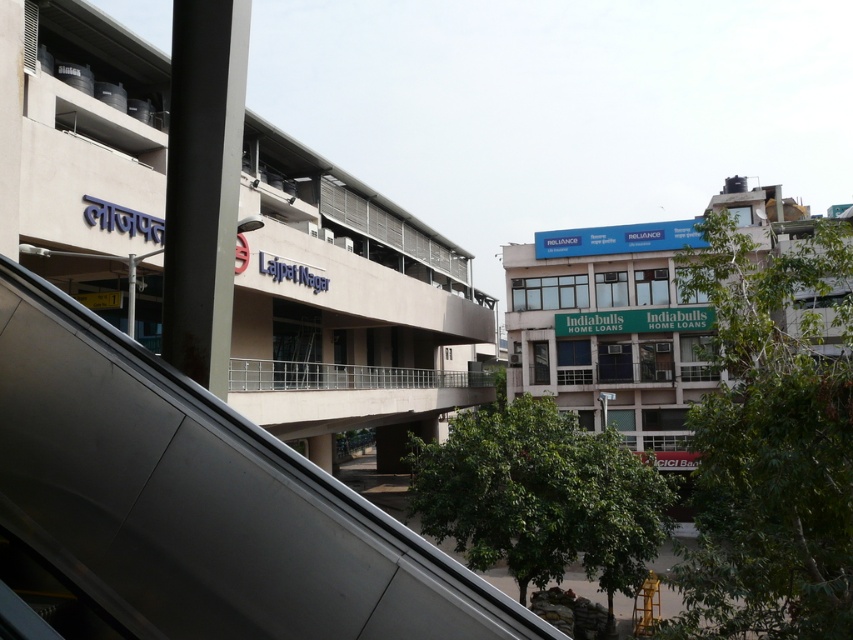
In the scene shown: You are standing at the entrance of the building and see two points marked in the image. Which point is closer to you, the point at coordinate (x=337, y=630) or the point at (x=252, y=364)?

Point (x=337, y=630) is in front of point (x=252, y=364), so it is closer to you.

Looking at this image, you are a delivery person carrying a large package that is 2 meters wide. You need to move from the beige concrete mall at center to the silver metallic railing at center. Is there enough space for your package to fit through the area between them?

The distance between the beige concrete mall at center and the silver metallic railing at center is 4.04 meters, which is wider than the 2 meters width of the package. Therefore, the package can fit through the space between them.